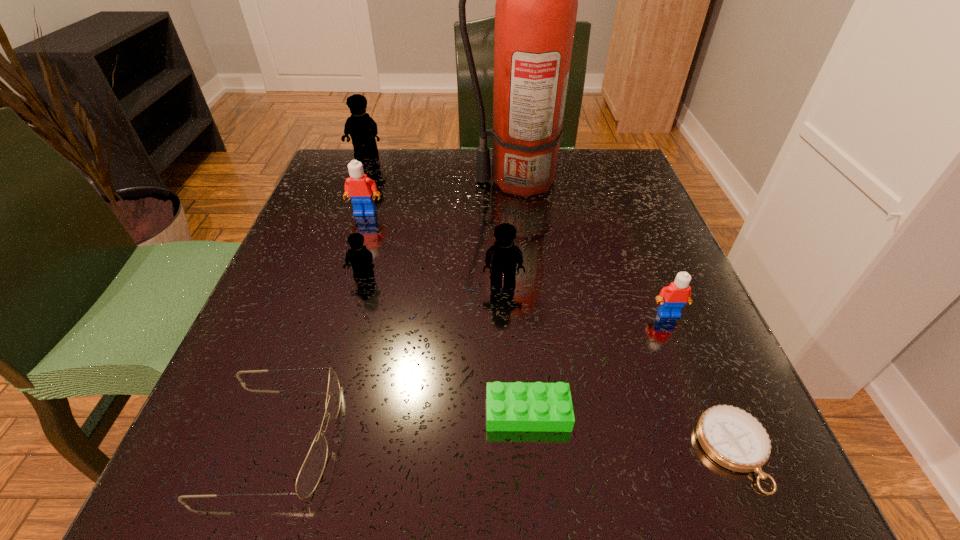
Where is `free space located 0.190m on the front-facing side of the rightmost yellow Lego`? The height and width of the screenshot is (540, 960). free space located 0.190m on the front-facing side of the rightmost yellow Lego is located at coordinates (509, 388).

Locate an element on the screen. vacant space located 0.080m on the front-facing side of the smallest yellow Lego is located at coordinates (352, 317).

Where is `vacant space located 0.090m on the face of the right white Lego`? vacant space located 0.090m on the face of the right white Lego is located at coordinates (689, 364).

Locate an element on the screen. The width and height of the screenshot is (960, 540). vacant space located on the front-facing side of the seventh tallest object is located at coordinates (404, 436).

The height and width of the screenshot is (540, 960). I want to click on blank area located on the back of the nearest Lego, so click(x=523, y=358).

Where is `free space located 0.350m on the back of the compass`? The height and width of the screenshot is (540, 960). free space located 0.350m on the back of the compass is located at coordinates (647, 246).

The image size is (960, 540). Find the location of `fire extinguisher that is at the far edge`. fire extinguisher that is at the far edge is located at coordinates (536, 6).

The width and height of the screenshot is (960, 540). What are the coordinates of `Lego present at the far edge` in the screenshot? It's located at (362, 128).

Find the location of a particular element. spectacles located in the near edge section of the desktop is located at coordinates (312, 469).

The width and height of the screenshot is (960, 540). In order to click on compass present at the near edge in this screenshot , I will do `click(733, 438)`.